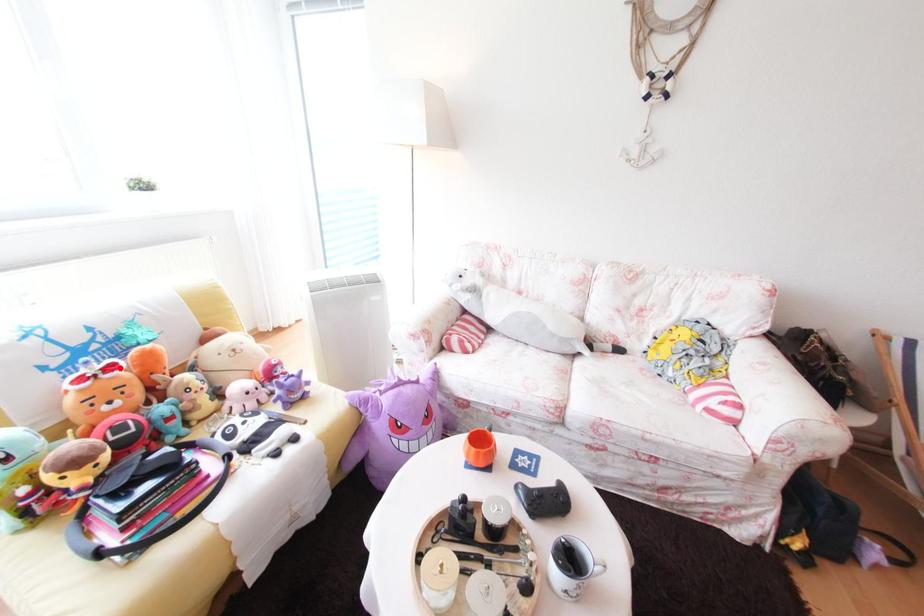
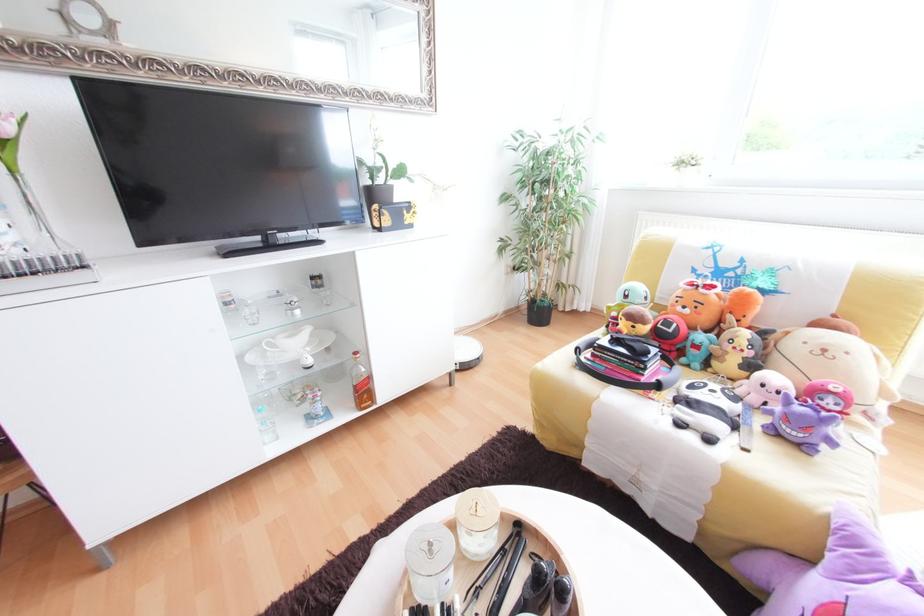
The point at the highlighted location is marked in the first image. Where is the corresponding point in the second image?

(719, 288)